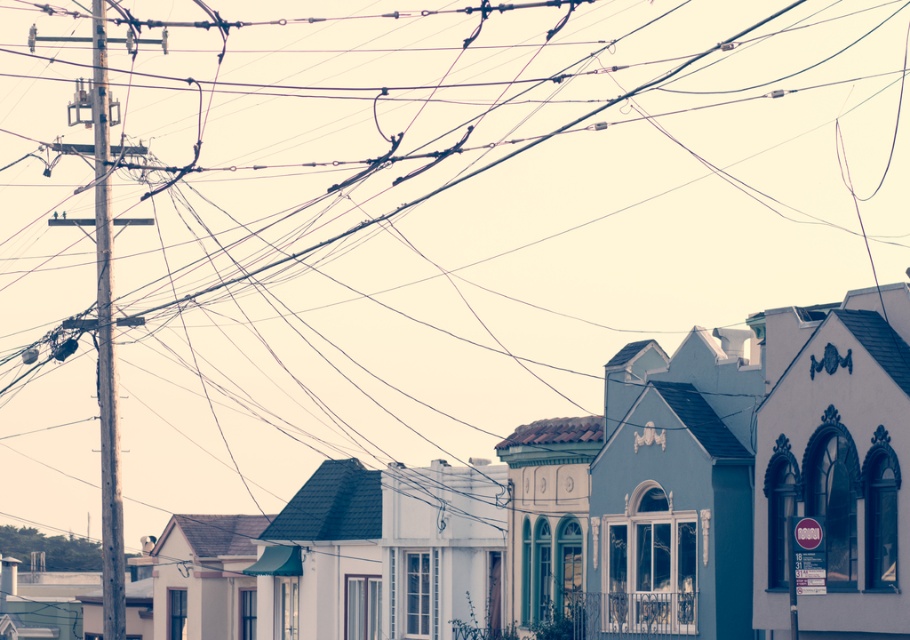
You are a delivery drone that needs to fly between the white matte building at center and the wooden telegraph pole at left. What is the minimum distance you need to cover to fly between them?

The minimum distance you need to cover to fly between the white matte building at center and the wooden telegraph pole at left is 7.42 meters.

You are a drone operator trying to fly a drone between the white matte building at center and the wooden telegraph pole at left. Can you fly the drone directly between them without hitting either structure?

The white matte building at center is in front of the wooden telegraph pole at left, meaning there is no space between them for the drone to pass through. The drone would hit one of the structures.